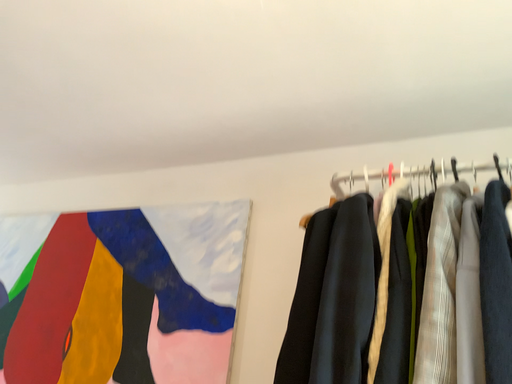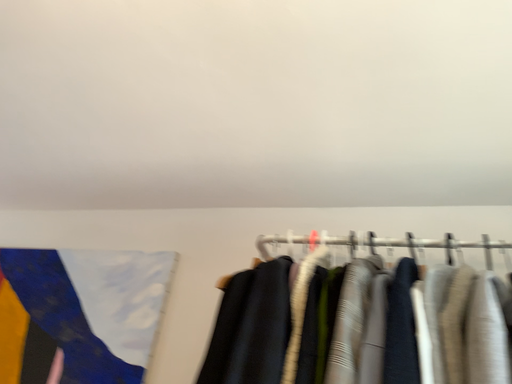
Question: How did the camera likely rotate when shooting the video?

Choices:
 (A) rotated downward
 (B) rotated upward

Answer: (B)